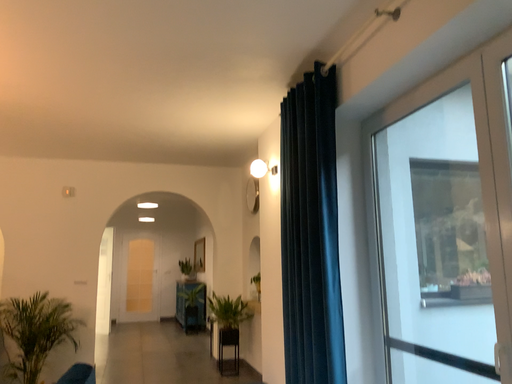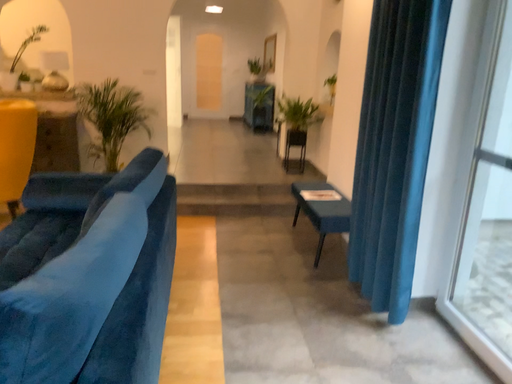
Question: Which way did the camera rotate in the video?

Choices:
 (A) rotated upward
 (B) rotated downward

Answer: (B)